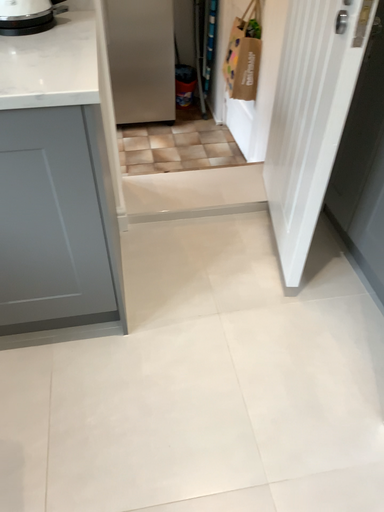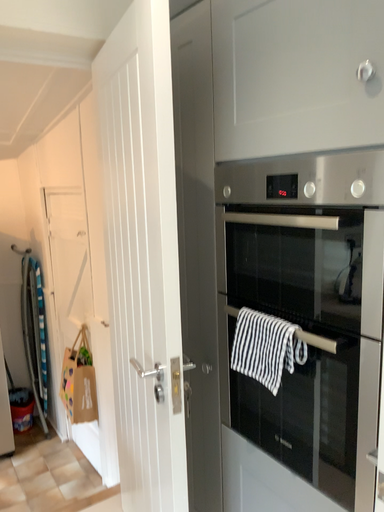
Question: Which way did the camera rotate in the video?

Choices:
 (A) rotated downward
 (B) rotated upward

Answer: (B)